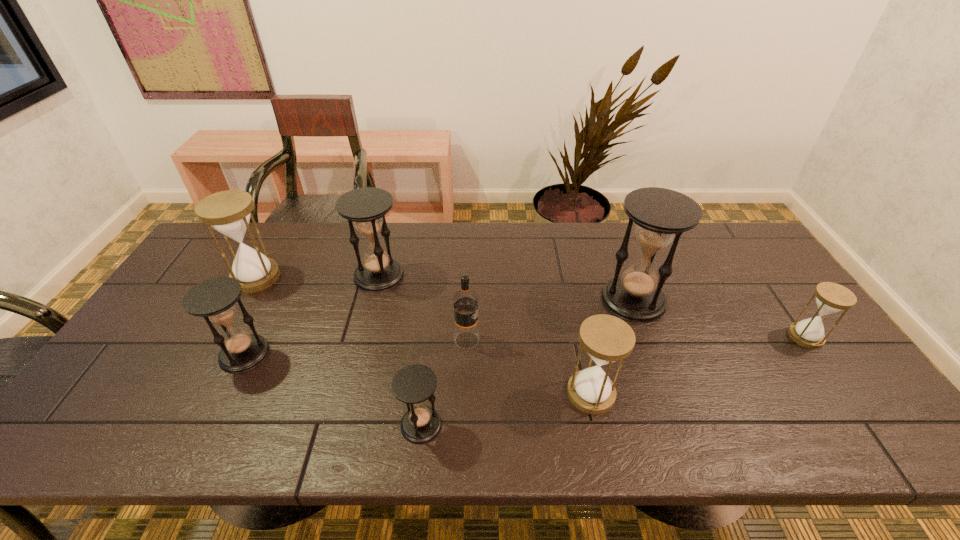
This screenshot has height=540, width=960. What are the coordinates of `vacant space situated 0.160m on the left of the second smallest white hourglass` in the screenshot? It's located at (501, 393).

Identify the location of free space located on the back of the rightmost object. The height and width of the screenshot is (540, 960). (782, 305).

Where is `vacant point located on the left of the nearest black hourglass`? vacant point located on the left of the nearest black hourglass is located at coordinates (238, 425).

Identify the location of object that is at the left edge. (228, 212).

This screenshot has width=960, height=540. Find the location of `object that is at the right edge`. object that is at the right edge is located at coordinates (831, 298).

In order to click on object that is positioned at the far left corner in this screenshot , I will do `click(228, 212)`.

Where is `vacant region at the far edge of the desktop`? This screenshot has width=960, height=540. vacant region at the far edge of the desktop is located at coordinates (305, 224).

Where is `vacant space at the near edge of the desktop`? vacant space at the near edge of the desktop is located at coordinates (388, 450).

Locate an element on the screen. free space at the left edge of the desktop is located at coordinates (x=133, y=393).

This screenshot has height=540, width=960. What are the coordinates of `vacant position at the right edge of the desktop` in the screenshot? It's located at (737, 290).